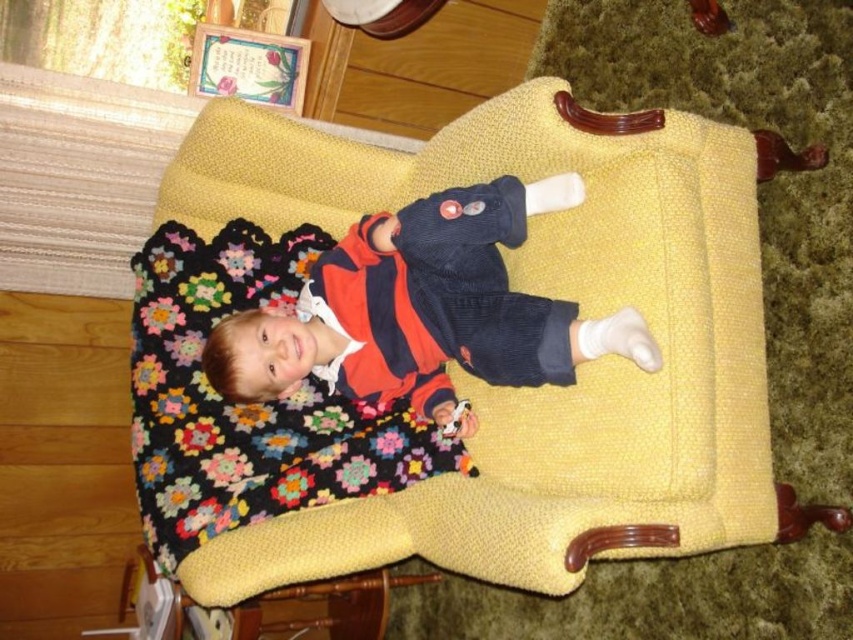
Which of these two, matte corduroy sweater at center or multicolored knitted blanket at center, stands shorter?

matte corduroy sweater at center is shorter.

Looking at this image, does matte corduroy sweater at center have a smaller size compared to multicolored knitted blanket at center?

Actually, matte corduroy sweater at center might be larger than multicolored knitted blanket at center.

You are a GUI agent. You are given a task and a screenshot of the screen. Output one action in this format:
    pyautogui.click(x=<x>, y=<y>)
    Task: Click on the matte corduroy sweater at center
    This screenshot has width=853, height=640.
    Given the screenshot: What is the action you would take?
    pyautogui.click(x=424, y=310)

Identify the location of matte corduroy sweater at center. click(424, 310).